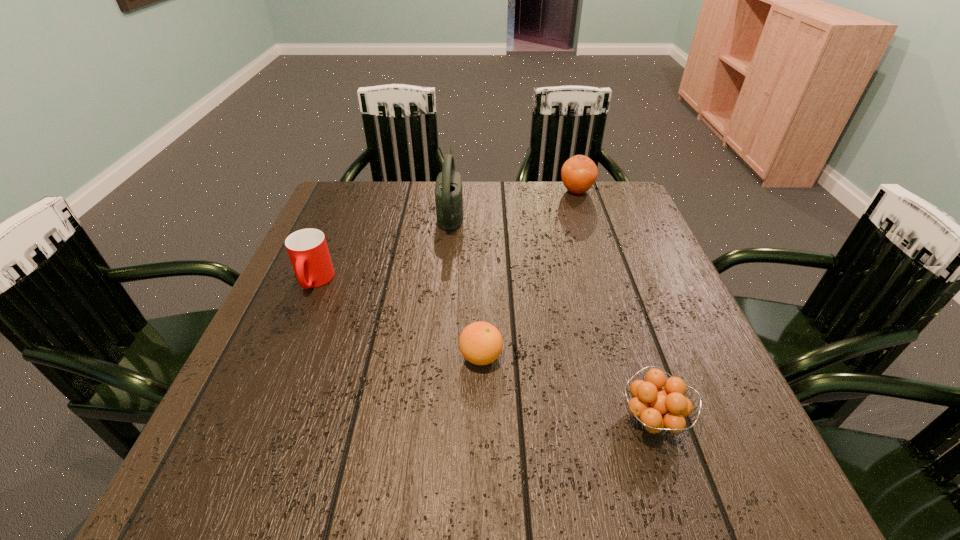
Image resolution: width=960 pixels, height=540 pixels. What are the coordinates of `watering can` in the screenshot? It's located at (448, 188).

Locate an element on the screen. the second object from left to right is located at coordinates (448, 188).

The height and width of the screenshot is (540, 960). I want to click on the tallest orange, so click(579, 173).

Where is `the third nearest object`? This screenshot has height=540, width=960. the third nearest object is located at coordinates (307, 248).

Find the location of `the leftmost object`. the leftmost object is located at coordinates (307, 248).

Find the location of `the nearest object`. the nearest object is located at coordinates (657, 408).

You are a GUI agent. You are given a task and a screenshot of the screen. Output one action in this format:
    pyautogui.click(x=<x>, y=<y>)
    Task: Click on the third object from left to right
    This screenshot has height=540, width=960.
    Given the screenshot: What is the action you would take?
    pyautogui.click(x=480, y=343)

The image size is (960, 540). I want to click on the second nearest orange, so click(480, 343).

You are a GUI agent. You are given a task and a screenshot of the screen. Output one action in this format:
    pyautogui.click(x=<x>, y=<y>)
    Task: Click on the vacant space located on the spout of the tallest object
    This screenshot has height=540, width=960.
    Given the screenshot: What is the action you would take?
    pyautogui.click(x=510, y=211)

At what (x,y) coordinates should I click in order to perform the action: click on vacant area situated 0.300m on the front of the tallest orange. Please return your answer as a coordinate pair (x, y). This screenshot has height=540, width=960. Looking at the image, I should click on (601, 265).